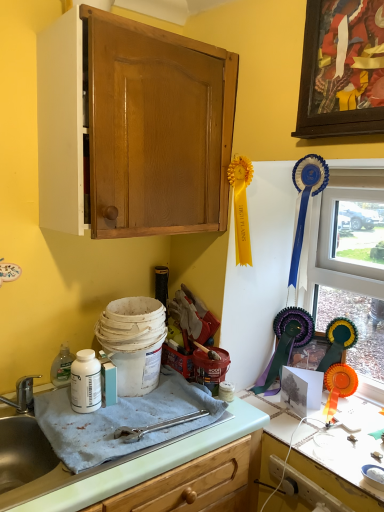
At what (x,y) coordinates should I click in order to perform the action: click on vacant space situated above light green laminate countertop at lower center, which appears as the second countertop when viewed from the right (from a real-world perspective). Please return your answer as a coordinate pair (x, y). The height and width of the screenshot is (512, 384). Looking at the image, I should click on (116, 413).